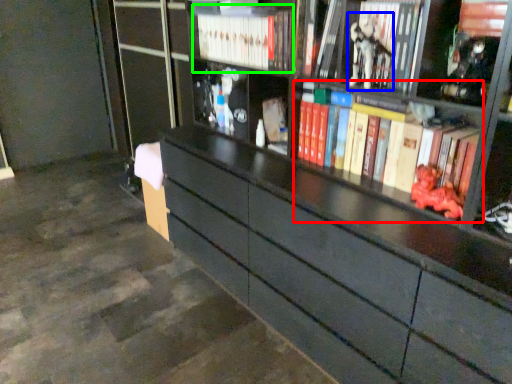
Question: Which is farther away from book (highlighted by a red box)? toy (highlighted by a blue box) or book (highlighted by a green box)?

Choices:
 (A) toy
 (B) book

Answer: (B)